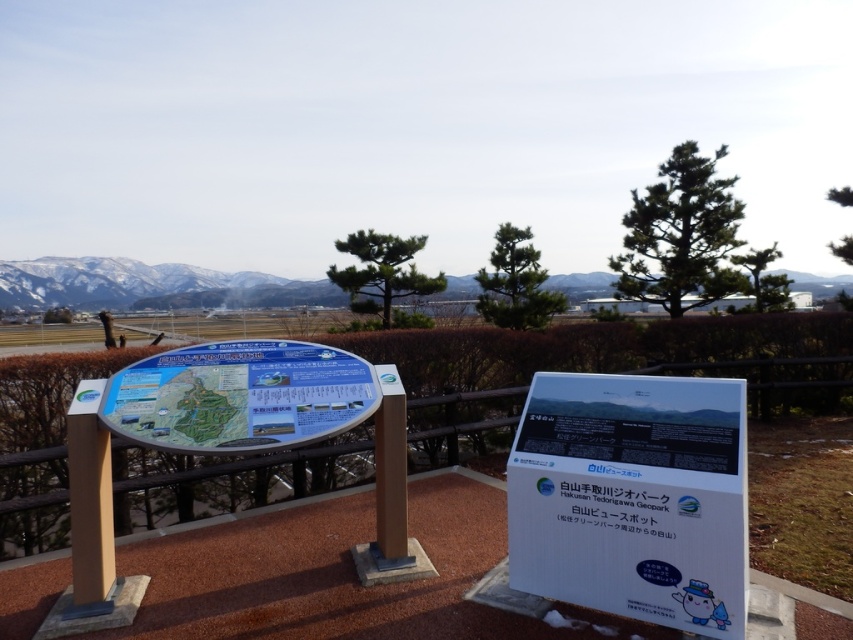
Question: Estimate the real-world distances between objects in this image. Which object is closer to the white plastic sign at center?

Choices:
 (A) snowy white mountain at upper center
 (B) blue plastic map at center

Answer: (B)

Question: Can you confirm if blue plastic map at center is positioned below snowy white mountain at upper center?

Choices:
 (A) no
 (B) yes

Answer: (B)

Question: Does white plastic sign at center appear over snowy white mountain at upper center?

Choices:
 (A) no
 (B) yes

Answer: (A)

Question: Which point is farther to the camera?

Choices:
 (A) white plastic sign at center
 (B) blue plastic map at center

Answer: (B)

Question: Is blue plastic map at center in front of snowy white mountain at upper center?

Choices:
 (A) yes
 (B) no

Answer: (A)

Question: Among these objects, which one is nearest to the camera?

Choices:
 (A) white plastic sign at center
 (B) blue plastic map at center
 (C) snowy white mountain at upper center

Answer: (A)